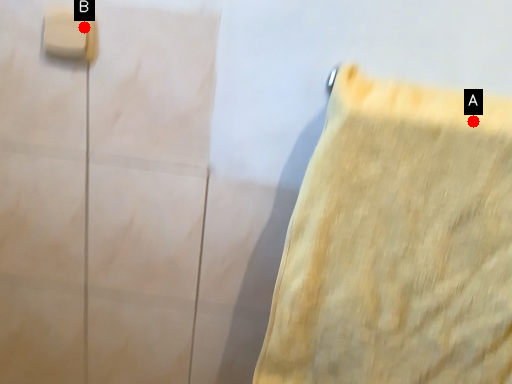
Question: Two points are circled on the image, labeled by A and B beside each circle. Which point is farther from the camera taking this photo?

Choices:
 (A) A is further
 (B) B is further

Answer: (B)